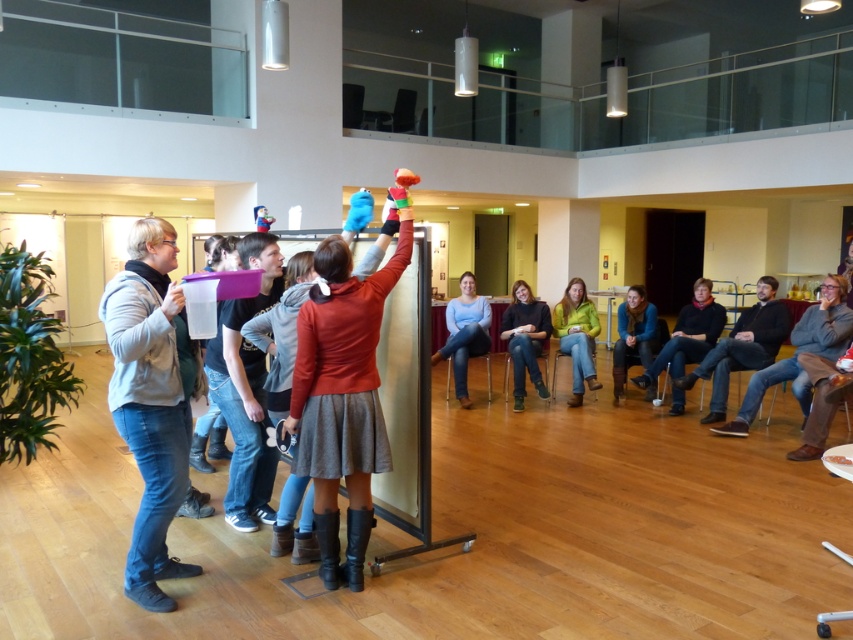
Between reddish-brown leather jacket at center and blue jeans at center, which one is positioned higher?

blue jeans at center is higher up.

Is point (346, 300) closer to camera compared to point (486, 353)?

Yes, it is.

Who is more distant from viewer, (346,448) or (486,340)?

The point (486,340) is behind.

The width and height of the screenshot is (853, 640). Find the location of `reddish-brown leather jacket at center`. reddish-brown leather jacket at center is located at coordinates (341, 396).

Which of these two, jeans at center or green fuzzy sweater at center, stands shorter?

With less height is jeans at center.

Based on the photo, does jeans at center have a larger size compared to green fuzzy sweater at center?

Yes.

You are a GUI agent. You are given a task and a screenshot of the screen. Output one action in this format:
    pyautogui.click(x=<x>, y=<y>)
    Task: Click on the jeans at center
    Image resolution: width=853 pixels, height=640 pixels.
    Given the screenshot: What is the action you would take?
    525,339

Does reddish-brown leather jacket at center have a lesser height compared to dark blue jeans at center?

No.

Is reddish-brown leather jacket at center to the left of dark blue jeans at center from the viewer's perspective?

Correct, you'll find reddish-brown leather jacket at center to the left of dark blue jeans at center.

Does point (370, 278) come closer to viewer compared to point (688, 356)?

Yes, it is in front of point (688, 356).

Locate an element on the screen. Image resolution: width=853 pixels, height=640 pixels. reddish-brown leather jacket at center is located at coordinates [341, 396].